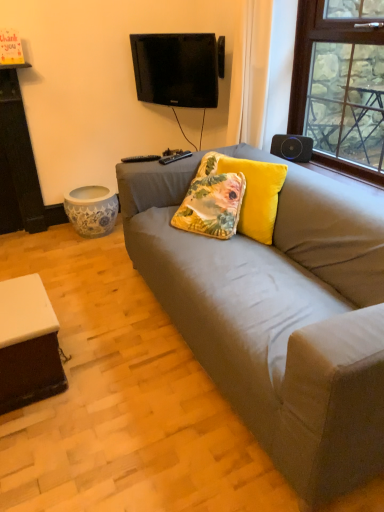
Question: In terms of height, does black matte speaker at upper right look taller or shorter compared to matte gray couch at center?

Choices:
 (A) tall
 (B) short

Answer: (B)

Question: Is black matte speaker at upper right wider or thinner than matte gray couch at center?

Choices:
 (A) thin
 (B) wide

Answer: (A)

Question: Which object is positioned closest to the velvet yellow pillow at center, the 1th pillow from the right?

Choices:
 (A) white matte table at lower left
 (B) floral fabric pillow at center, positioned as the second pillow in right-to-left order
 (C) black glossy tv at upper center
 (D) black matte speaker at upper right
 (E) matte gray couch at center

Answer: (B)

Question: Which of these objects is positioned closest to the black glossy tv at upper center?

Choices:
 (A) white matte table at lower left
 (B) black matte speaker at upper right
 (C) velvet yellow pillow at center, positioned as the 2th pillow in left-to-right order
 (D) matte gray couch at center
 (E) floral fabric pillow at center, positioned as the second pillow in right-to-left order

Answer: (B)